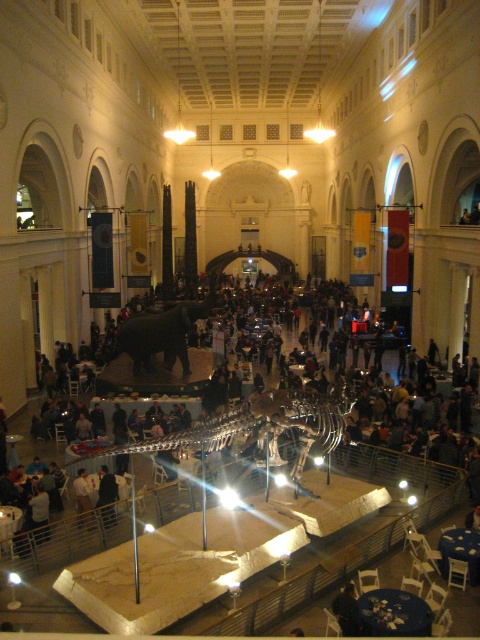
You are a visitor in the hall and want to take a photo of both the shiny black elephant at center and the dark blue fabric at center in the same frame. Your camera has a maximum zoom range that can capture objects up to 30 meters apart. Will you be able to fit both objects into the frame without moving closer?

The distance between the shiny black elephant at center and the dark blue fabric at center is 32.42 meters, which exceeds the camera maximum zoom range of 30 meters. Therefore, you cannot fit both objects into the frame without moving closer.

You are an event planner setting up a photo booth in the museum hall. You need to decide where to place it so that it doesn not block the view of the shiny metallic dinosaur skeleton at center and the dark blue fabric at center. Which object is wider, and thus requires more space between the photo booth and the object to avoid blocking its view?

The shiny metallic dinosaur skeleton at center is wider than the dark blue fabric at center, so it requires more space between the photo booth and the object to avoid blocking its view.

You are standing in the grand hall and want to locate the shiny black elephant at center. According to the coordinates provided, where should you look relative to the dinosaur skeleton exhibit?

The shiny black elephant at center is located at coordinates point (160,333), which means it is positioned to the right and slightly below the dinosaur skeleton exhibit.